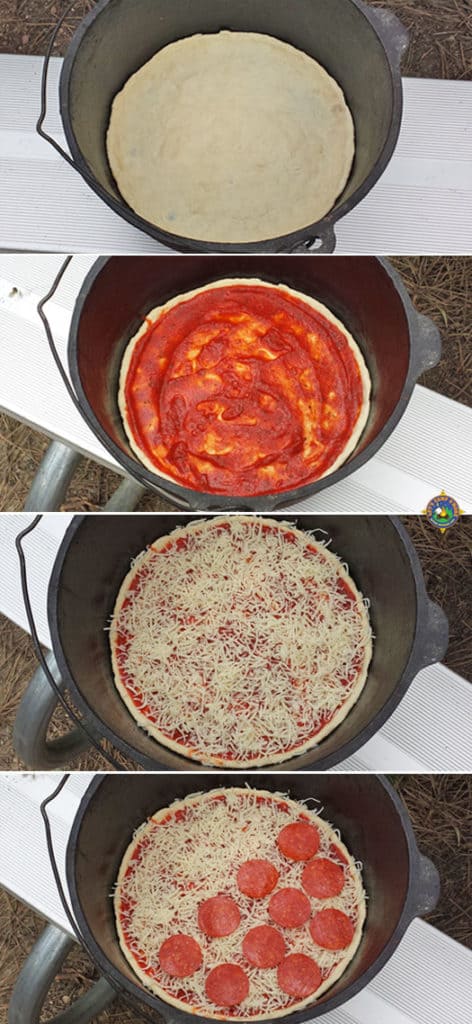
Identify the location of frying pan. (401, 874), (398, 636), (381, 85), (404, 361).